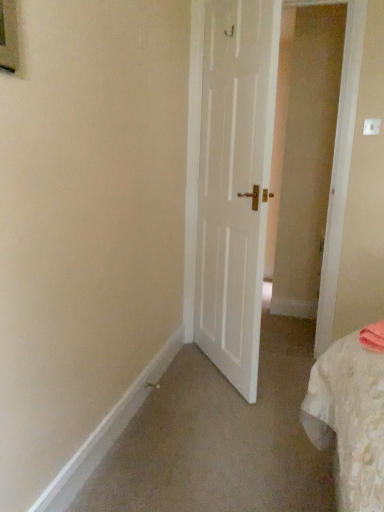
Question: Looking at the image, does white plastic electric outlet at upper right seem bigger or smaller compared to white matte door at center?

Choices:
 (A) small
 (B) big

Answer: (A)

Question: From a real-world perspective, is white plastic electric outlet at upper right positioned above or below white matte door at center?

Choices:
 (A) below
 (B) above

Answer: (B)

Question: Would you say white plastic electric outlet at upper right is inside or outside white matte door at center?

Choices:
 (A) inside
 (B) outside

Answer: (B)

Question: Does point (211, 326) appear closer or farther from the camera than point (372, 125)?

Choices:
 (A) closer
 (B) farther

Answer: (B)

Question: From the image's perspective, is white matte door at center above or below white plastic electric outlet at upper right?

Choices:
 (A) above
 (B) below

Answer: (B)

Question: Is white matte door at center bigger or smaller than white plastic electric outlet at upper right?

Choices:
 (A) small
 (B) big

Answer: (B)

Question: Considering the positions of white matte door at center and white plastic electric outlet at upper right in the image, is white matte door at center taller or shorter than white plastic electric outlet at upper right?

Choices:
 (A) short
 (B) tall

Answer: (B)